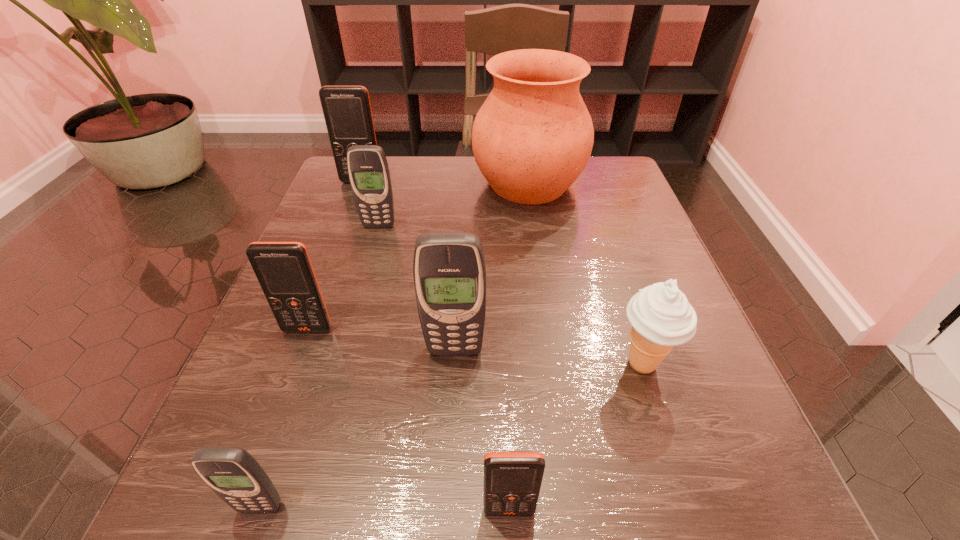
Where is `pottery`? The image size is (960, 540). pottery is located at coordinates (533, 136).

Find the location of a particular element. This screenshot has height=540, width=960. the biggest orange cellular telephone is located at coordinates (347, 111).

The image size is (960, 540). I want to click on the farthest orange cellular telephone, so click(347, 111).

Image resolution: width=960 pixels, height=540 pixels. Find the location of `the rightmost gray cellular telephone`. the rightmost gray cellular telephone is located at coordinates (449, 268).

The width and height of the screenshot is (960, 540). I want to click on the biggest gray cellular telephone, so click(x=449, y=268).

Find the location of a particular element. the third farthest object is located at coordinates (368, 170).

Locate an element on the screen. the second biggest gray cellular telephone is located at coordinates (368, 170).

Identify the location of the second farthest orange cellular telephone. Image resolution: width=960 pixels, height=540 pixels. (284, 270).

In order to click on the second biggest orange cellular telephone in this screenshot , I will do `click(284, 270)`.

Find the location of a particular element. beige icecream is located at coordinates (661, 317).